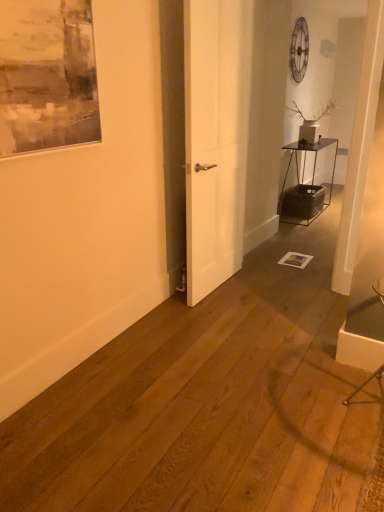
Identify the location of vacant space behind metallic silver armchair at lower right. This screenshot has height=512, width=384. (324, 357).